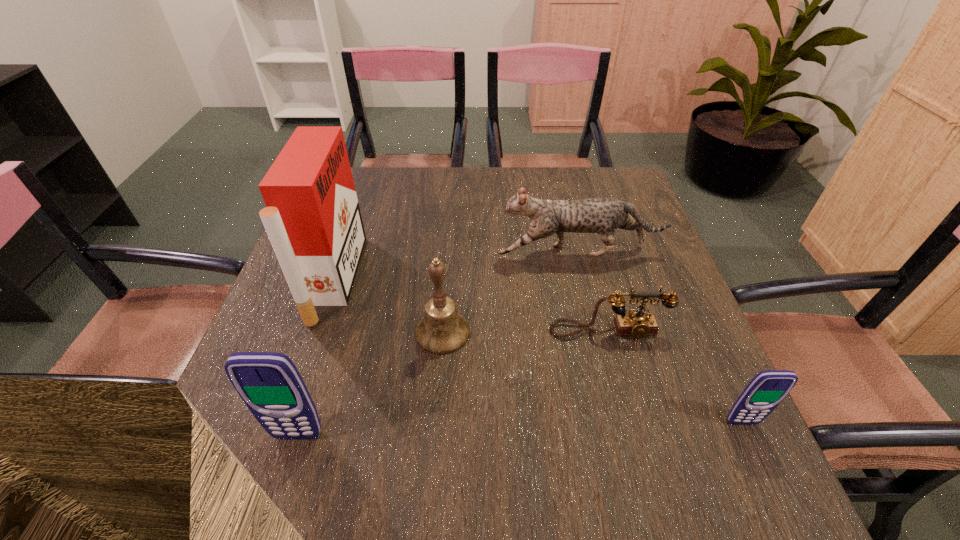
At what (x,y) coordinates should I click in order to perform the action: click on free space located on the face of the cat. Please return your answer as a coordinate pair (x, y). The width and height of the screenshot is (960, 540). Looking at the image, I should click on (344, 252).

This screenshot has width=960, height=540. I want to click on vacant space located 0.230m on the face of the cat, so click(x=407, y=252).

At what (x,y) coordinates should I click in order to perform the action: click on free space located 0.230m on the front-facing side of the cigarette case. Please return your answer as a coordinate pair (x, y). Looking at the image, I should click on (452, 279).

Where is `free space located 0.140m on the front-facing side of the shortest object`? The height and width of the screenshot is (540, 960). free space located 0.140m on the front-facing side of the shortest object is located at coordinates (627, 402).

Where is `cellular telephone present at the left edge`? The image size is (960, 540). cellular telephone present at the left edge is located at coordinates (269, 383).

Find the location of `cigarette case located in the left edge section of the desktop`. cigarette case located in the left edge section of the desktop is located at coordinates (312, 217).

This screenshot has width=960, height=540. Identify the location of cellular telephone that is positioned at the right edge. (767, 389).

Locate an element on the screen. The height and width of the screenshot is (540, 960). cat that is positioned at the right edge is located at coordinates (602, 216).

Where is `telephone that is at the right edge`? Image resolution: width=960 pixels, height=540 pixels. telephone that is at the right edge is located at coordinates (637, 323).

Identify the location of object at the near left corner. (269, 383).